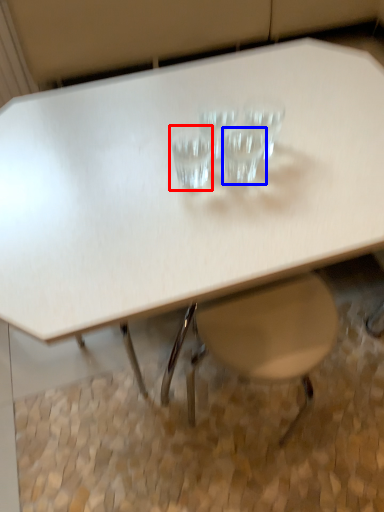
Question: Which point is closer to the camera, martini glass (highlighted by a red box) or martini glass (highlighted by a blue box)?

Choices:
 (A) martini glass
 (B) martini glass

Answer: (A)